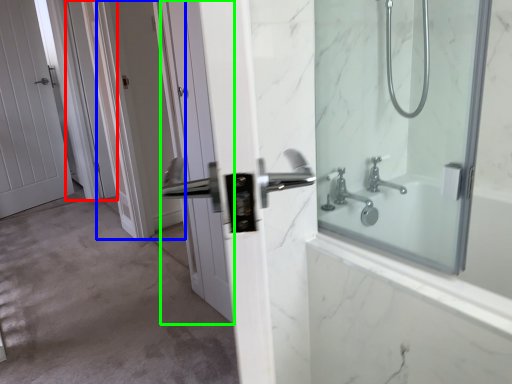
Question: Based on their relative distances, which object is farther from screen door (highlighted by a red box)? Choose from screen door (highlighted by a blue box) and door (highlighted by a green box).

Choices:
 (A) screen door
 (B) door

Answer: (B)